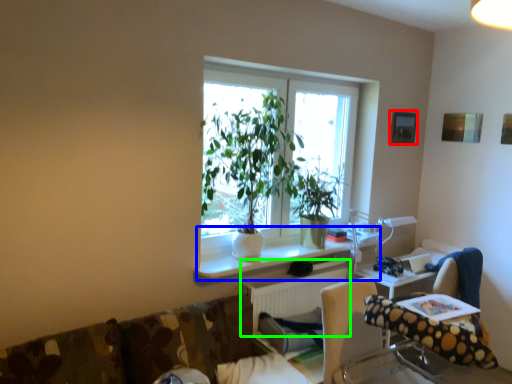
Question: Estimate the real-world distances between objects in this image. Which object is farther from picture frame (highlighted by a red box), computer desk (highlighted by a blue box) or radiator (highlighted by a green box)?

Choices:
 (A) computer desk
 (B) radiator

Answer: (B)